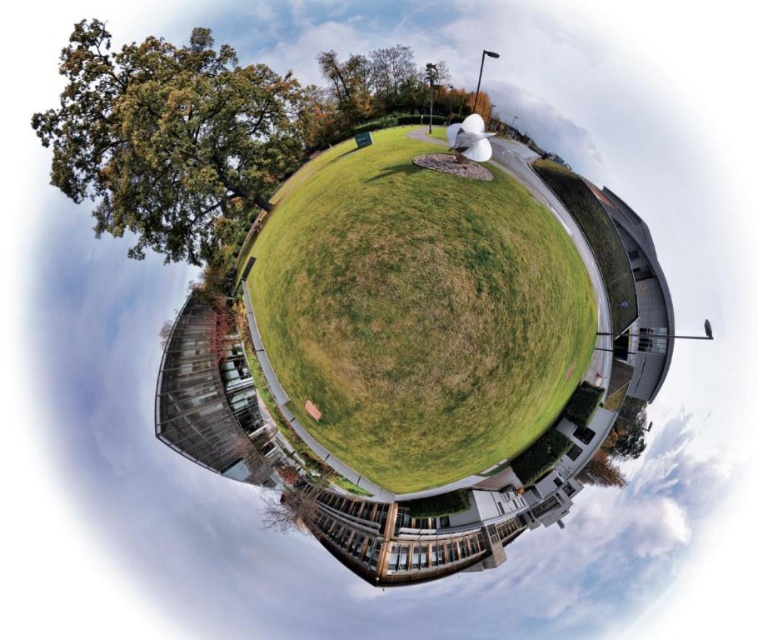
Can you confirm if green grassy at center is thinner than green leafy tree at upper left?

Incorrect, green grassy at center's width is not less than green leafy tree at upper left's.

Who is more forward, (556,221) or (77,113)?

Point (77,113) is more forward.

This screenshot has height=640, width=758. In order to click on green grassy at center in this screenshot , I will do `click(418, 314)`.